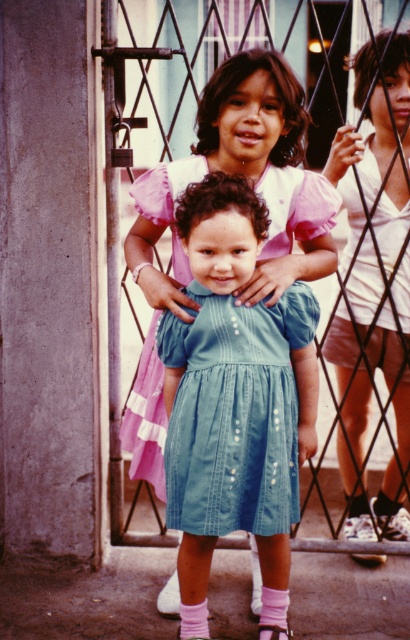
Is denim dress at center thinner than white satin blouse at upper right?

No, denim dress at center is not thinner than white satin blouse at upper right.

Who is positioned more to the left, denim dress at center or white satin blouse at upper right?

denim dress at center

Does point (179, 636) come closer to viewer compared to point (384, 36)?

That is True.

Find the location of `denim dress at center`. denim dress at center is located at coordinates (234, 401).